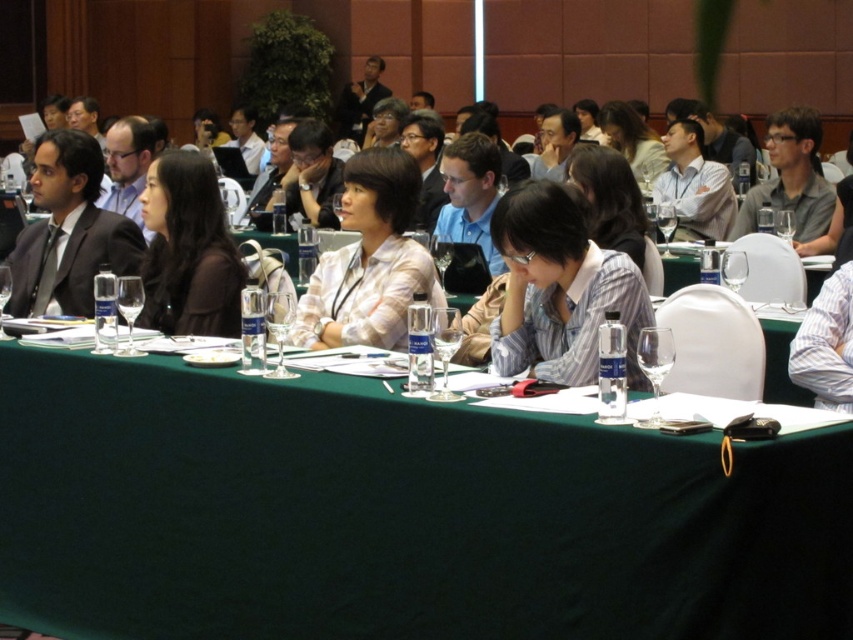
Does matte black shirt at center have a greater width compared to blue shirt at center?

Yes, matte black shirt at center is wider than blue shirt at center.

Which is in front, point (184, 173) or point (477, 147)?

Point (184, 173) is more forward.

Locate an element on the screen. The image size is (853, 640). matte black shirt at center is located at coordinates (189, 250).

Is point (44, 136) closer to viewer compared to point (469, 237)?

Yes, it is.

Is point (120, 272) closer to camera compared to point (498, 157)?

Yes, it is in front of point (498, 157).

Identify the location of dark gray suit at left. (68, 230).

Does matte black shirt at center appear on the left side of white shirt at center?

Yes, matte black shirt at center is to the left of white shirt at center.

Can you confirm if matte black shirt at center is positioned below white shirt at center?

Correct, matte black shirt at center is located below white shirt at center.

Is point (148, 260) positioned in front of point (659, 204)?

Yes, it is in front of point (659, 204).

Image resolution: width=853 pixels, height=640 pixels. Identify the location of matte black shirt at center. (189, 250).